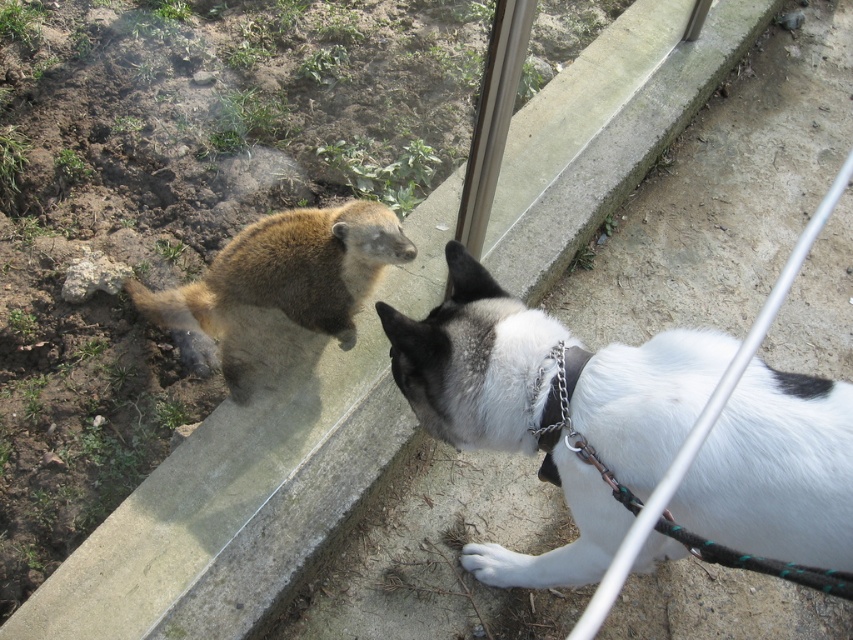
Question: Does transparent glass door at upper center appear over metal chain at lower right?

Choices:
 (A) yes
 (B) no

Answer: (A)

Question: Is transparent glass door at upper center to the right of white fur paw at lower center from the viewer's perspective?

Choices:
 (A) no
 (B) yes

Answer: (A)

Question: Which point is farther to the camera?

Choices:
 (A) brown fur animal at upper left
 (B) white fur paw at lower center
 (C) white fur dog at lower right

Answer: (A)

Question: Does white fur paw at lower center lie behind metal chain at lower right?

Choices:
 (A) no
 (B) yes

Answer: (B)

Question: Which point is farther to the camera?

Choices:
 (A) (128, 611)
 (B) (492, 566)
 (C) (693, 484)

Answer: (B)

Question: Which object is positioned farthest from the white fur dog at lower right?

Choices:
 (A) brown fur animal at upper left
 (B) transparent glass door at upper center
 (C) white fur paw at lower center
 (D) metal chain at lower right

Answer: (B)